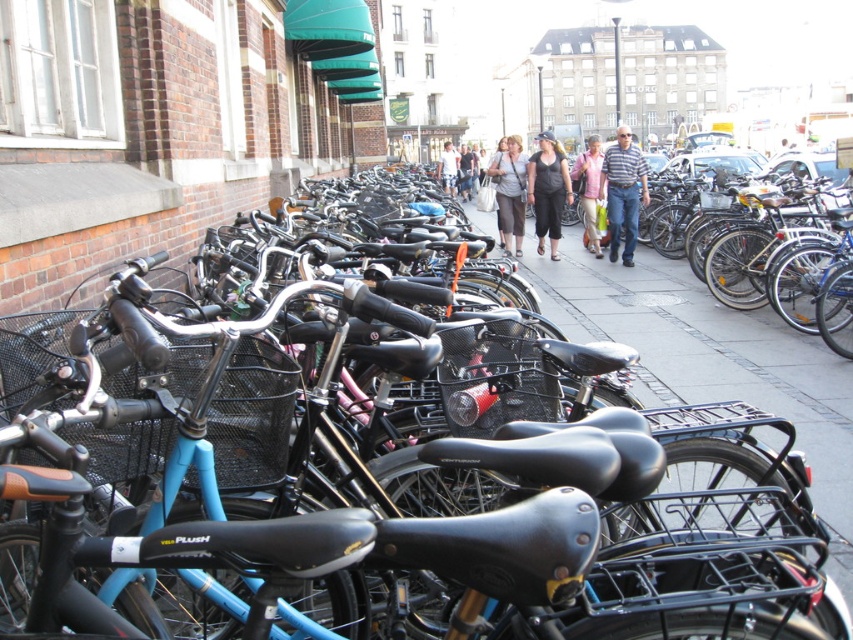
Between point (663, 364) and point (531, 180), which one is positioned behind?

The point (531, 180) is behind.

Does gray concrete pavement at center appear under matte black pants at center?

Yes.

Locate an element on the screen. gray concrete pavement at center is located at coordinates (712, 362).

Between point (598, 182) and point (473, 164), which one is positioned in front?

Point (598, 182) is more forward.

Does pink fabric shirt at center appear on the left side of light blue fabric pants at center?

Incorrect, pink fabric shirt at center is not on the left side of light blue fabric pants at center.

Does point (599, 241) come in front of point (465, 180)?

Yes, it is.

Find the location of a particular element. pink fabric shirt at center is located at coordinates (589, 189).

Consider the image. Is black matte bicycle at center taller than matte black pants at center?

No, black matte bicycle at center is not taller than matte black pants at center.

Image resolution: width=853 pixels, height=640 pixels. What do you see at coordinates (376, 484) in the screenshot?
I see `black matte bicycle at center` at bounding box center [376, 484].

In order to click on black matte bicycle at center in this screenshot , I will do `click(376, 484)`.